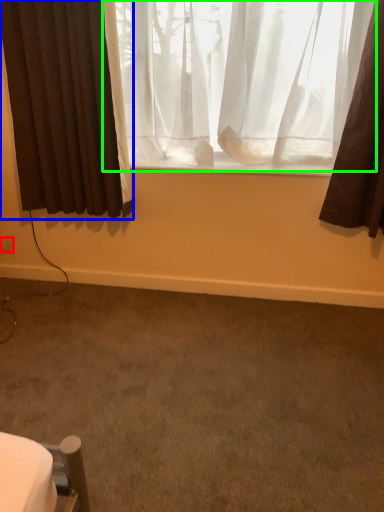
Question: Estimate the real-world distances between objects in this image. Which object is farther from electric outlet (highlighted by a red box), curtain (highlighted by a blue box) or curtain (highlighted by a green box)?

Choices:
 (A) curtain
 (B) curtain

Answer: (B)